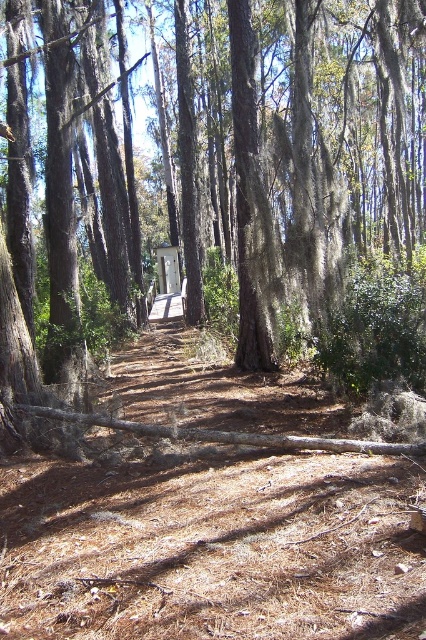
You are a hiker standing on the dirt path in the forest scene. You notice a brown rough tree at center and a white wood gazebo at center. Which object is closer to you?

The brown rough tree at center is positioned over the white wood gazebo at center, meaning the brown rough tree at center is closer to you.

You are a hiker trying to decide whether to rest under the brown rough tree at center or the white wood gazebo at center. Which one provides more shade?

The brown rough tree at center is larger in size than the white wood gazebo at center, so it likely provides more shade.